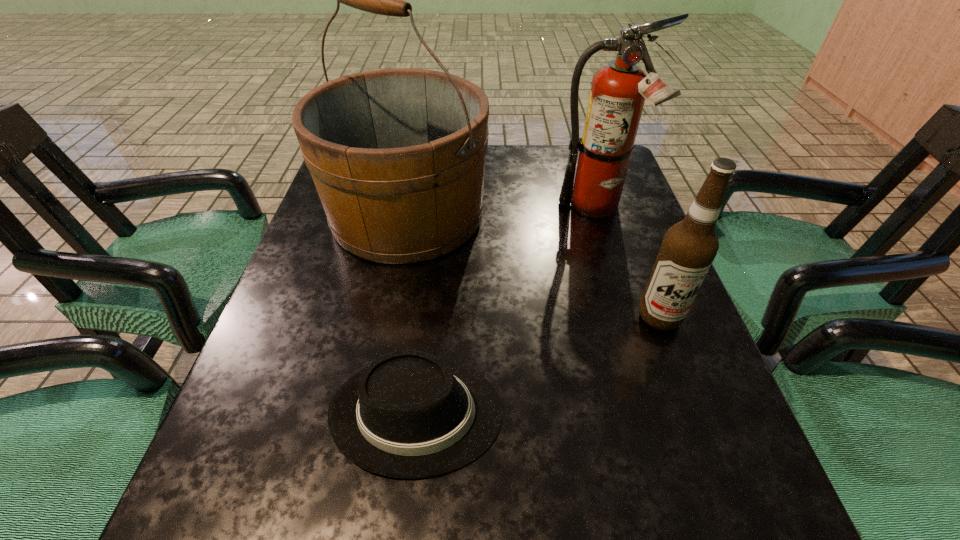
Locate an element on the screen. bucket is located at coordinates (397, 156).

In order to click on fire extinguisher in this screenshot , I will do `click(618, 91)`.

You are a GUI agent. You are given a task and a screenshot of the screen. Output one action in this format:
    pyautogui.click(x=<x>, y=<y>)
    Task: Click on the second nearest object
    The image size is (960, 540).
    Given the screenshot: What is the action you would take?
    pyautogui.click(x=689, y=247)

The height and width of the screenshot is (540, 960). Find the location of `alcohol`. alcohol is located at coordinates (689, 247).

This screenshot has width=960, height=540. I want to click on the shortest object, so click(408, 415).

In order to click on fedora in this screenshot , I will do `click(408, 415)`.

The height and width of the screenshot is (540, 960). In order to click on vacant space positioned on the back of the bucket in this screenshot , I will do `click(419, 158)`.

Where is `free region located from the nozzle of the fire extinguisher`? free region located from the nozzle of the fire extinguisher is located at coordinates (614, 269).

The height and width of the screenshot is (540, 960). Find the location of `vacant area situated on the label of the alcohol`. vacant area situated on the label of the alcohol is located at coordinates (736, 523).

Find the location of a particular element. This screenshot has width=960, height=540. vacant region located on the front-facing side of the fedora is located at coordinates (721, 413).